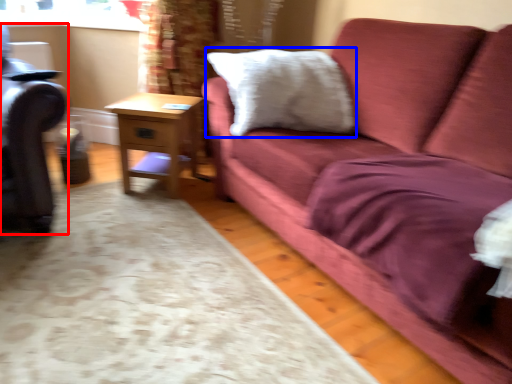
Question: Which of the following is the farthest to the observer, swivel chair (highlighted by a red box) or pillow (highlighted by a blue box)?

Choices:
 (A) swivel chair
 (B) pillow

Answer: (B)